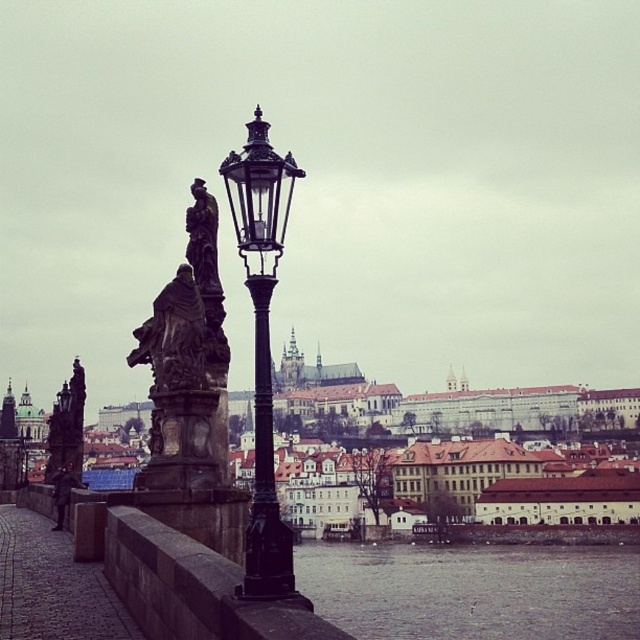
Question: Is black metal pole at center behind dark brown stone statue at center?

Choices:
 (A) yes
 (B) no

Answer: (B)

Question: Based on their relative distances, which object is farther from the gray water at lower center?

Choices:
 (A) brown stone prague castle at center
 (B) bronze statue at left

Answer: (A)

Question: Is black metal street light at center to the left of bronze statue at left from the viewer's perspective?

Choices:
 (A) no
 (B) yes

Answer: (A)

Question: Which point is closer to the camera taking this photo?

Choices:
 (A) (268, 404)
 (B) (189, 244)
 (C) (212, 406)

Answer: (A)

Question: Which object is the closest to the gray water at lower center?

Choices:
 (A) bronze statue at left
 (B) black metal pole at center
 (C) black metal street light at center
 (D) dark stone statue at center

Answer: (B)

Question: From the image, what is the correct spatial relationship of black metal street light at center in relation to black metal pole at center?

Choices:
 (A) below
 (B) above

Answer: (A)